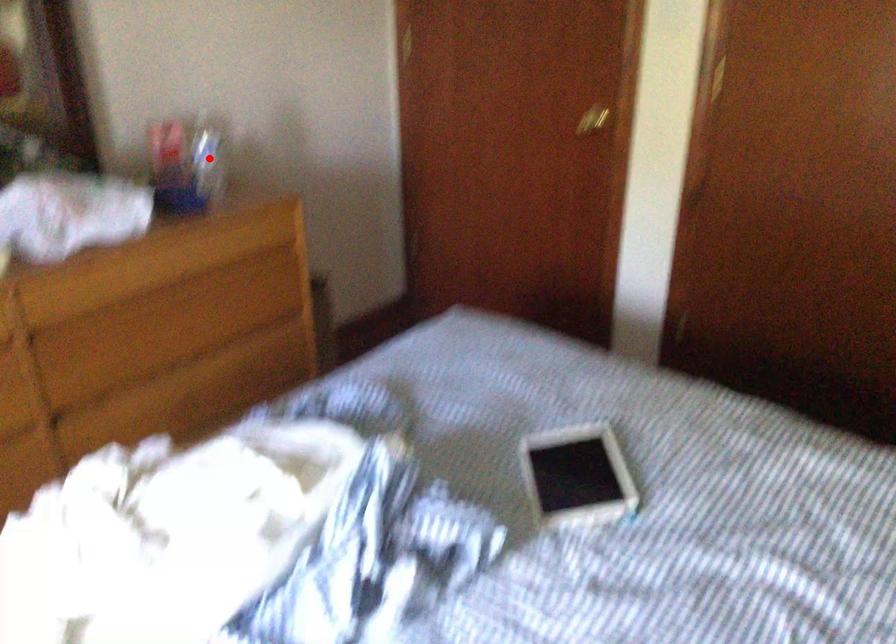
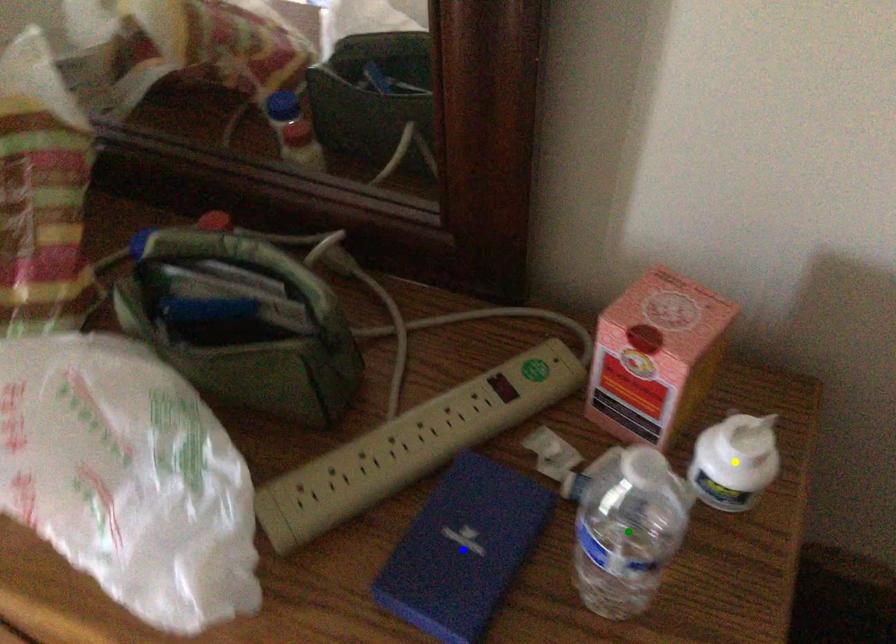
Question: I am providing you with two images of the same scene from different viewpoints. A red point is marked on the first image. You are given multiple points on the second image. In image 2, which mark is for the same physical point as the one in image 1?

Choices:
 (A) green point
 (B) blue point
 (C) yellow point

Answer: (C)